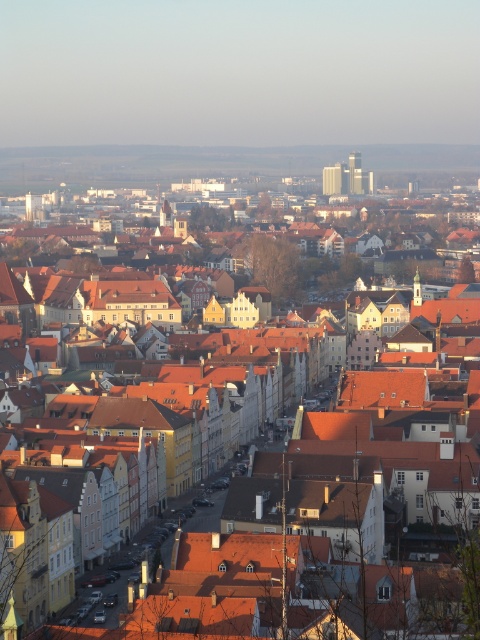
Can you confirm if gray concrete skyscraper at upper center is positioned above matte glass skyscraper at upper center?

Indeed, gray concrete skyscraper at upper center is positioned over matte glass skyscraper at upper center.

The image size is (480, 640). In order to click on gray concrete skyscraper at upper center in this screenshot , I will do click(355, 173).

Locate an element on the screen. The image size is (480, 640). matte orange rooftops at center is located at coordinates (379, 433).

Measure the distance between matte orange rooftops at center and matte glass skyscraper at upper center.

They are 156.38 meters apart.

Measure the distance between matte orange rooftops at center and camera.

matte orange rooftops at center is 95.33 meters away from camera.

Image resolution: width=480 pixels, height=640 pixels. Identify the location of matte orange rooftops at center. 379,433.

Can you confirm if matte orange rooftops at center is positioned to the right of gray concrete skyscraper at upper center?

In fact, matte orange rooftops at center is to the left of gray concrete skyscraper at upper center.

How far apart are matte orange rooftops at center and gray concrete skyscraper at upper center?

A distance of 166.03 meters exists between matte orange rooftops at center and gray concrete skyscraper at upper center.

Does point (448, 332) come farther from viewer compared to point (360, 172)?

No, (448, 332) is in front of (360, 172).

Image resolution: width=480 pixels, height=640 pixels. I want to click on matte orange rooftops at center, so click(x=379, y=433).